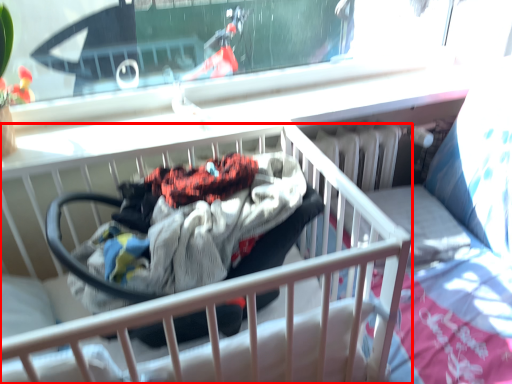
Question: Where is infant bed (annotated by the red box) located in relation to baby carriage in the image?

Choices:
 (A) right
 (B) left

Answer: (B)